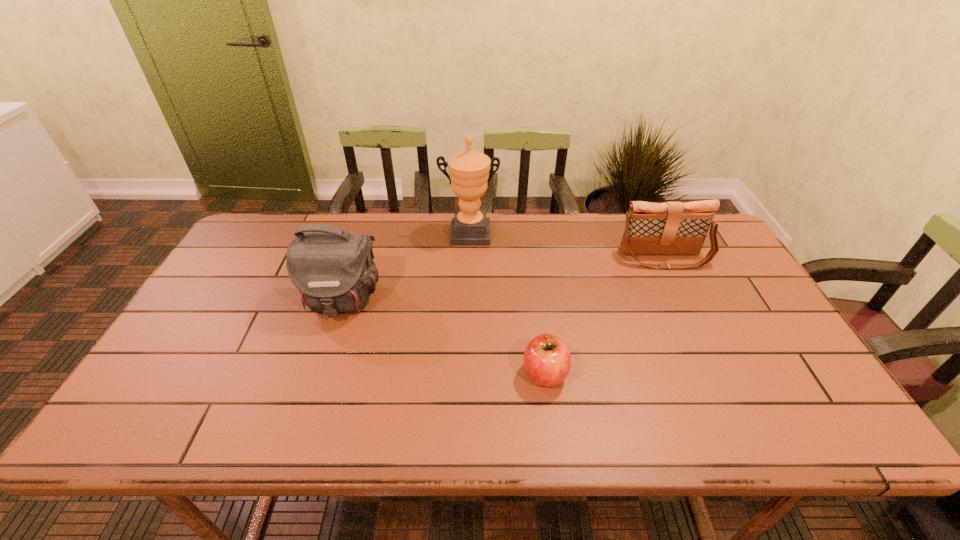
Locate an element on the screen. This screenshot has width=960, height=540. the tallest object is located at coordinates (469, 170).

The height and width of the screenshot is (540, 960). In order to click on the second object from left to right in this screenshot , I will do `click(469, 170)`.

This screenshot has height=540, width=960. Find the location of `the third shortest object`. the third shortest object is located at coordinates (333, 269).

Image resolution: width=960 pixels, height=540 pixels. Identify the location of the leftmost object. (333, 269).

The height and width of the screenshot is (540, 960). What are the coordinates of `the shorter shoulder bag` in the screenshot? It's located at (670, 228).

You are a GUI agent. You are given a task and a screenshot of the screen. Output one action in this format:
    pyautogui.click(x=<x>, y=<y>)
    Task: Click on the farther shoulder bag
    
    Given the screenshot: What is the action you would take?
    pyautogui.click(x=670, y=228)

At what (x,y) coordinates should I click in order to perform the action: click on apple. Please return your answer as a coordinate pair (x, y). This screenshot has height=540, width=960. Looking at the image, I should click on (547, 360).

Find the location of a particular element. Image resolution: width=960 pixels, height=540 pixels. the shortest object is located at coordinates (547, 360).

What are the coordinates of `vacant space located at the front of the farthest object with handles` in the screenshot? It's located at (467, 332).

Find the location of a particular element. vacant space located 0.240m on the open flap of the left shoulder bag is located at coordinates (305, 407).